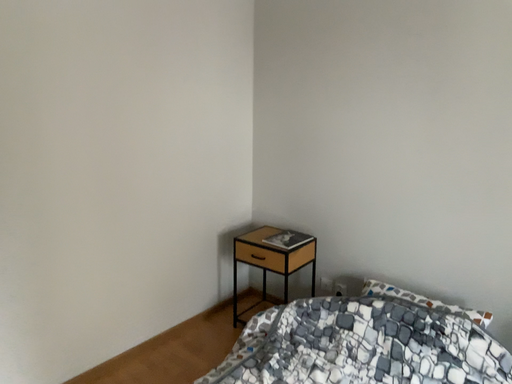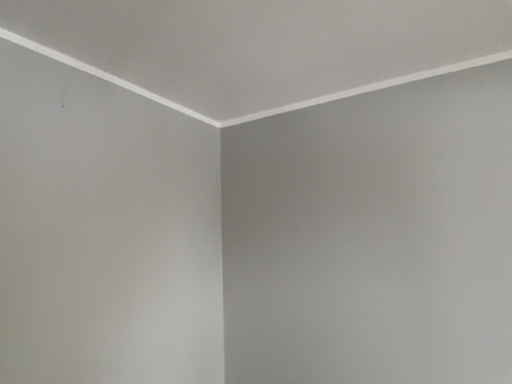
Question: How did the camera likely rotate when shooting the video?

Choices:
 (A) rotated right
 (B) rotated left

Answer: (A)